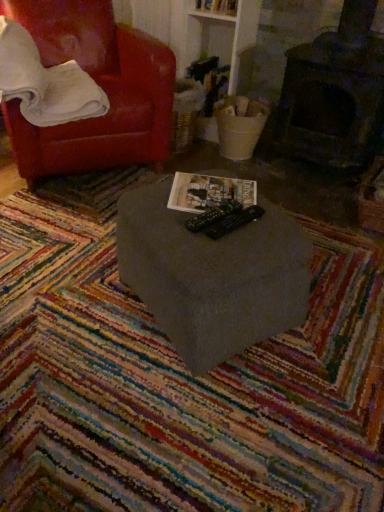
The width and height of the screenshot is (384, 512). Identify the location of vacant region above matte paper magazine at center (from a real-world perspective). (216, 188).